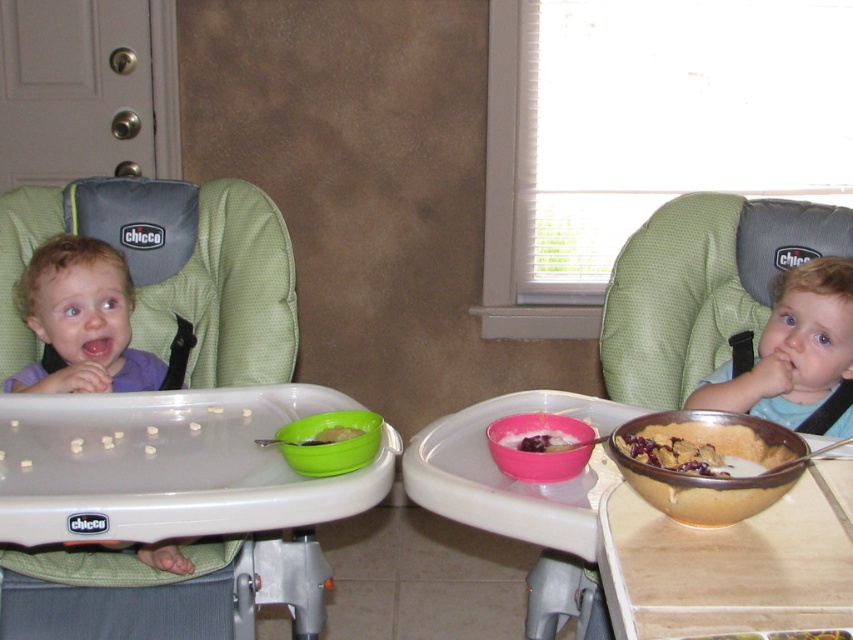
You are a parent trying to ensure your child can reach their food. You see the matte purple shirt at left and the green plastic bowl at center. Which object is higher up in the image?

The matte purple shirt at left is much taller as green plastic bowl at center, so the matte purple shirt at left is higher up.

You are a photographer taking a picture of the two children in the high chairs. You notice a point at coordinates (80,321) in the image. What object is located at this point?

The point at coordinates (80,321) corresponds to the matte purple shirt at left.

You are a parent trying to decide which item to give to your child first. The golden brown crumbly pie at right and the smooth pink bowl at center are both on the table. Which item is taller?

The golden brown crumbly pie at right is taller than the smooth pink bowl at center.